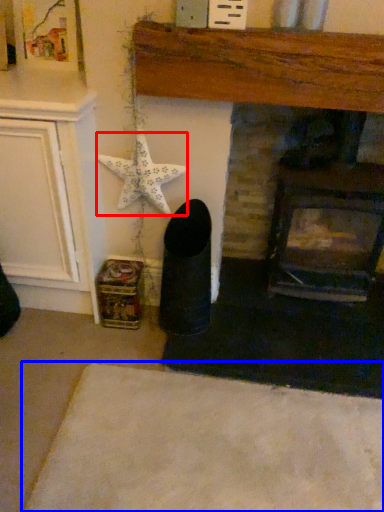
Question: Which object is closer to the camera taking this photo, starfish (highlighted by a red box) or plain (highlighted by a blue box)?

Choices:
 (A) starfish
 (B) plain

Answer: (B)